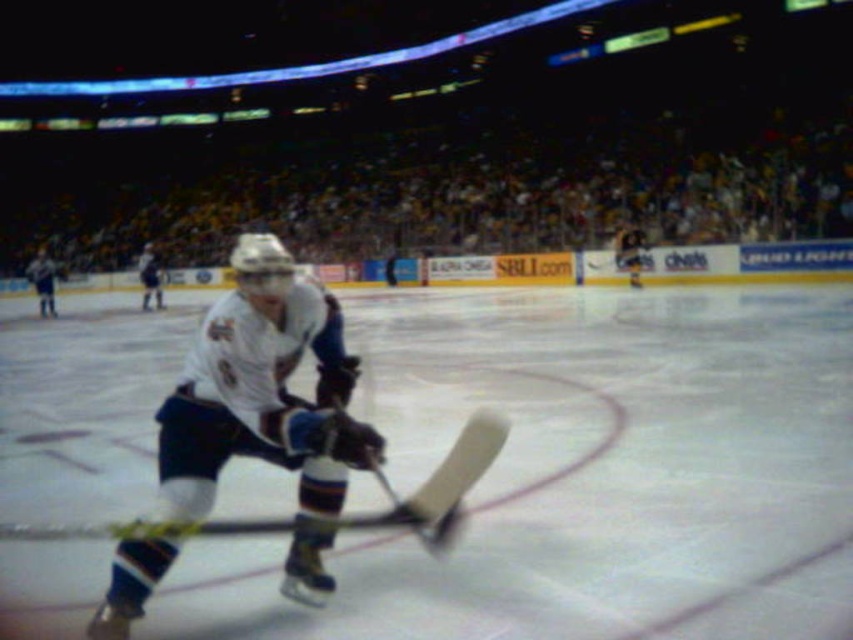
Question: Does white matte hockey stick at center have a larger size compared to white jersey at left?

Choices:
 (A) no
 (B) yes

Answer: (A)

Question: Does white matte hockey stick at center appear over white jersey at left?

Choices:
 (A) yes
 (B) no

Answer: (B)

Question: Among these points, which one is farthest from the camera?

Choices:
 (A) (39, 273)
 (B) (303, 285)

Answer: (A)

Question: Is white matte hockey stick at center above white jersey at left?

Choices:
 (A) no
 (B) yes

Answer: (A)